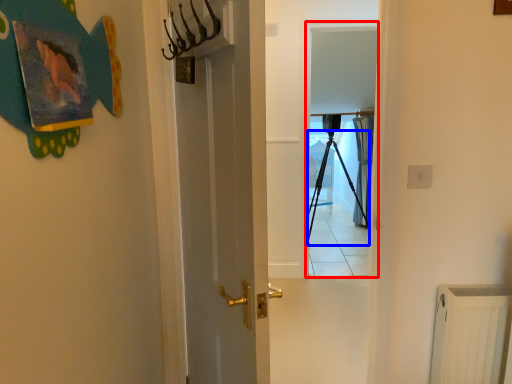
Question: Which point is closer to the camera, screen door (highlighted by a red box) or tripod (highlighted by a blue box)?

Choices:
 (A) screen door
 (B) tripod

Answer: (A)